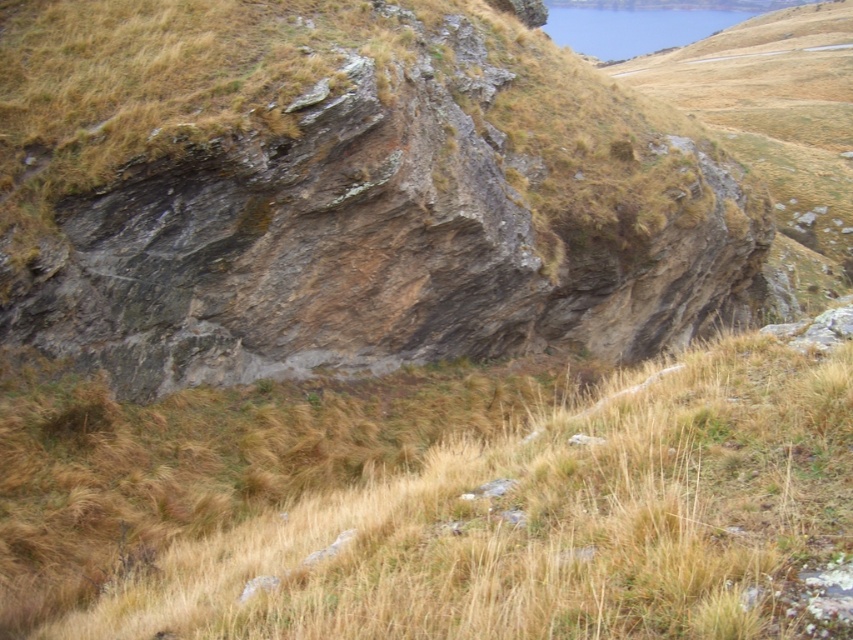
Question: Does rusty rock formation at center appear on the right side of dry grass at center?

Choices:
 (A) yes
 (B) no

Answer: (A)

Question: Is rusty rock formation at center behind dry grass at center?

Choices:
 (A) yes
 (B) no

Answer: (A)

Question: Which of the following is the closest to the observer?

Choices:
 (A) rusty rock formation at center
 (B) dry grass at center

Answer: (B)

Question: Which point is closer to the camera taking this photo?

Choices:
 (A) (787, 618)
 (B) (252, 252)

Answer: (A)

Question: Which point is closer to the camera?

Choices:
 (A) (497, 150)
 (B) (346, 451)

Answer: (B)

Question: Considering the relative positions of rusty rock formation at center and dry grass at center in the image provided, where is rusty rock formation at center located with respect to dry grass at center?

Choices:
 (A) left
 (B) right

Answer: (B)